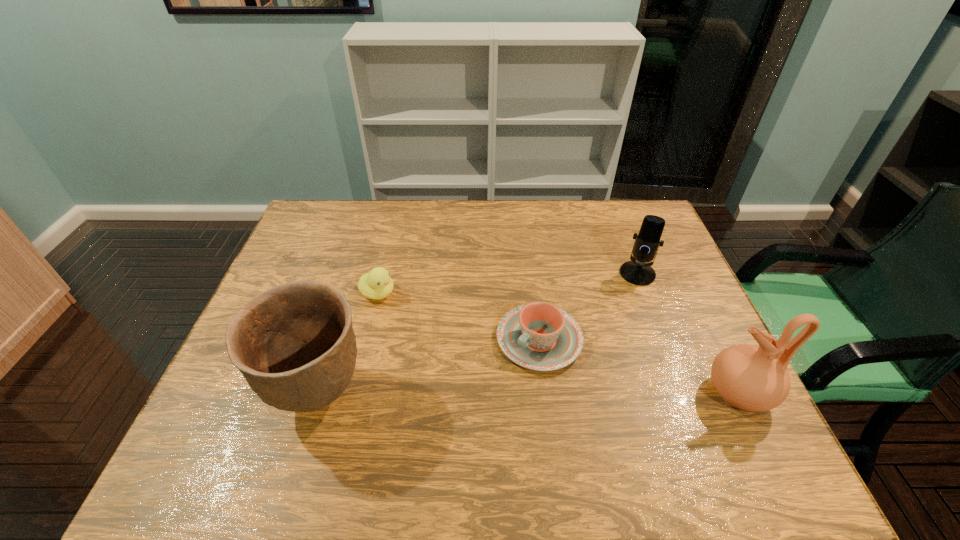
Where is `vacant spot on the desktop that is between the left pottery and the right pottery and is positioned on the stand of the third tallest object`? The image size is (960, 540). vacant spot on the desktop that is between the left pottery and the right pottery and is positioned on the stand of the third tallest object is located at coordinates (539, 394).

This screenshot has width=960, height=540. What are the coordinates of `free space on the desktop that is between the left pottery and the rightmost object and is positioned at the beak of the duckling` in the screenshot? It's located at (581, 394).

Identify the location of free space on the desktop that is between the left pottery and the rightmost object and is positioned on the handle side of the chinaware. (480, 394).